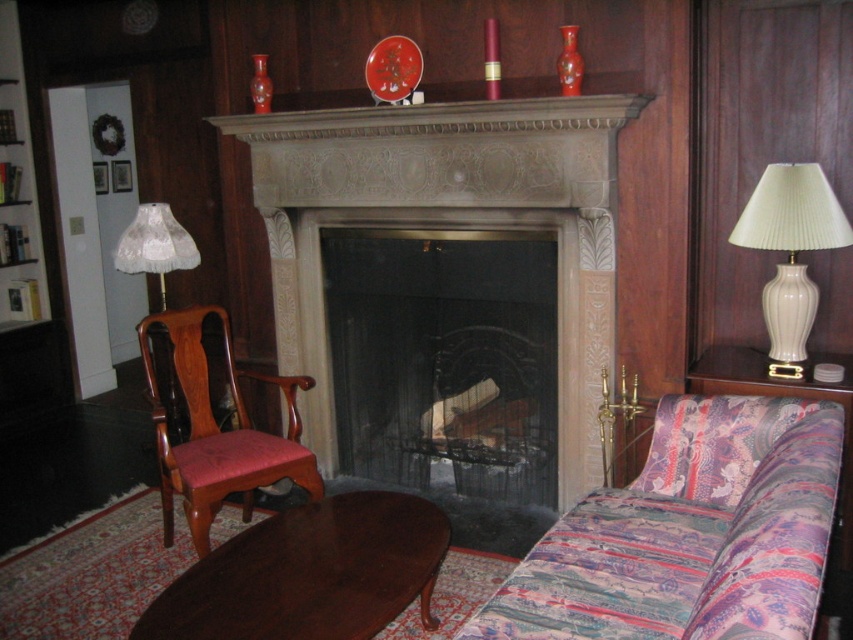
You are a guest entering the living room and want to sit down. The patterned fabric couch at lower right and the mahogany wood coffee table at lower center are in your view. Which one is higher in height?

The patterned fabric couch at lower right is taller than the mahogany wood coffee table at lower center, so the couch is higher.

You are sitting on the mahogany wood armchair at left and want to reach the white ceramic lamp at right. Can you easily reach it without moving from your seat?

The mahogany wood armchair at left is further to the viewer than the white ceramic lamp at right, meaning the lamp is closer to you. Therefore, you can easily reach it without moving from your seat.

You are sitting on the sofa and want to reach both the mahogany wood coffee table at lower center and the white lace lampshade at left. Which object is closer to you?

The mahogany wood coffee table at lower center is closer to you than the white lace lampshade at left.